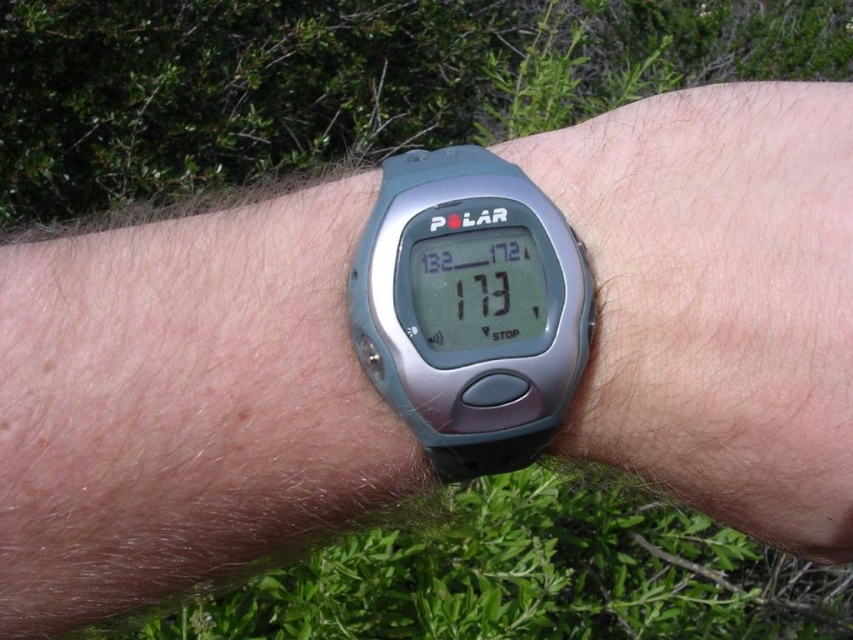
Question: Is satin silver watch at center positioned at the back of silver metallic watch at center?

Choices:
 (A) no
 (B) yes

Answer: (A)

Question: Can you confirm if satin silver watch at center is smaller than silver metallic watch at center?

Choices:
 (A) no
 (B) yes

Answer: (A)

Question: In this image, where is satin silver watch at center located relative to silver metallic watch at center?

Choices:
 (A) left
 (B) right

Answer: (B)

Question: Which point appears closest to the camera in this image?

Choices:
 (A) (524, 371)
 (B) (775, 538)

Answer: (A)

Question: Among these points, which one is nearest to the camera?

Choices:
 (A) (825, 316)
 (B) (498, 284)

Answer: (A)